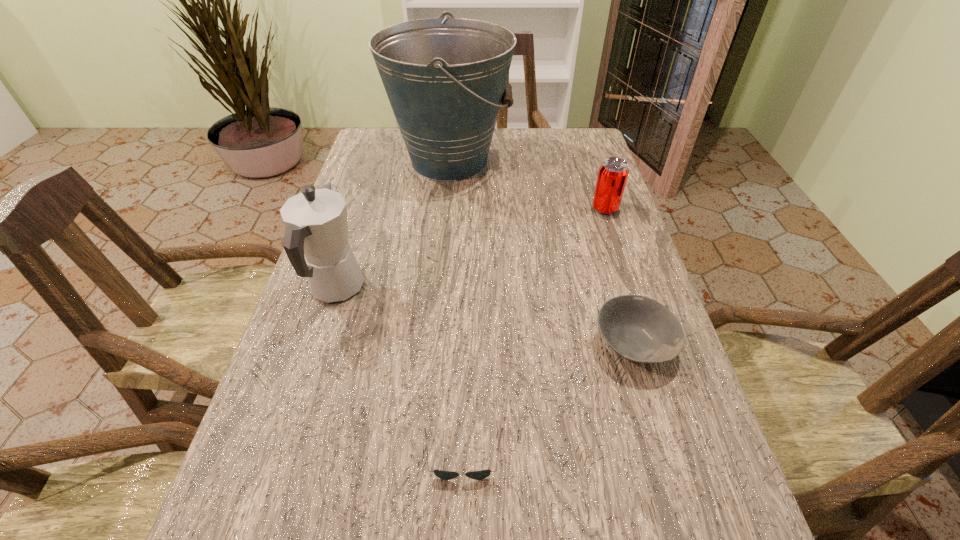
I want to click on free space located on the back of the third shortest object, so point(584,144).

The image size is (960, 540). Find the location of `free space located 0.180m on the left of the second shortest object`. free space located 0.180m on the left of the second shortest object is located at coordinates (499, 345).

Locate an element on the screen. The height and width of the screenshot is (540, 960). object at the far edge is located at coordinates (445, 79).

This screenshot has width=960, height=540. Identify the location of bucket located in the left edge section of the desktop. (445, 79).

Where is `coffeepot situated at the left edge`? The width and height of the screenshot is (960, 540). coffeepot situated at the left edge is located at coordinates (316, 242).

Where is `soda can positioned at the right edge`? soda can positioned at the right edge is located at coordinates (613, 173).

I want to click on bowl situated at the right edge, so click(639, 329).

The height and width of the screenshot is (540, 960). What are the coordinates of `object located in the far left corner section of the desktop` in the screenshot? It's located at (445, 79).

Where is `free space at the far edge`? The width and height of the screenshot is (960, 540). free space at the far edge is located at coordinates (506, 166).

The height and width of the screenshot is (540, 960). I want to click on free spot at the left edge of the desktop, so click(x=376, y=245).